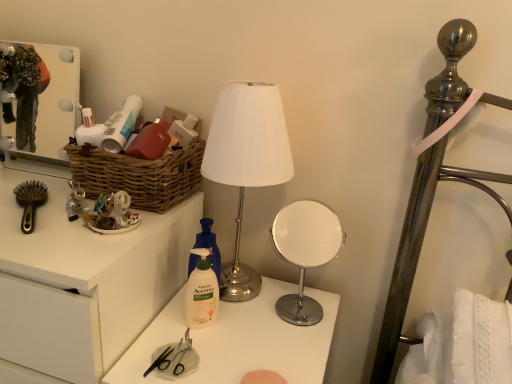
This screenshot has height=384, width=512. I want to click on vacant space underneath white matte lamp at center (from a real-world perspective), so click(243, 292).